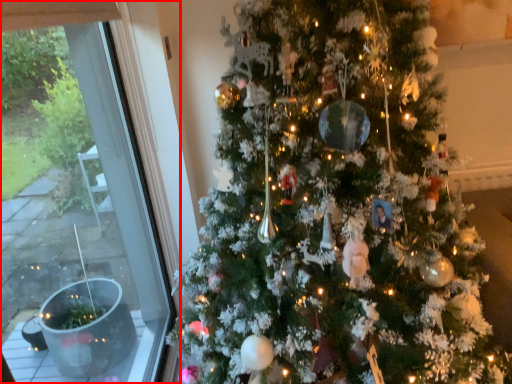
Question: Observing the image, what is the correct spatial positioning of window (annotated by the red box) in reference to christmas tree?

Choices:
 (A) right
 (B) left

Answer: (B)